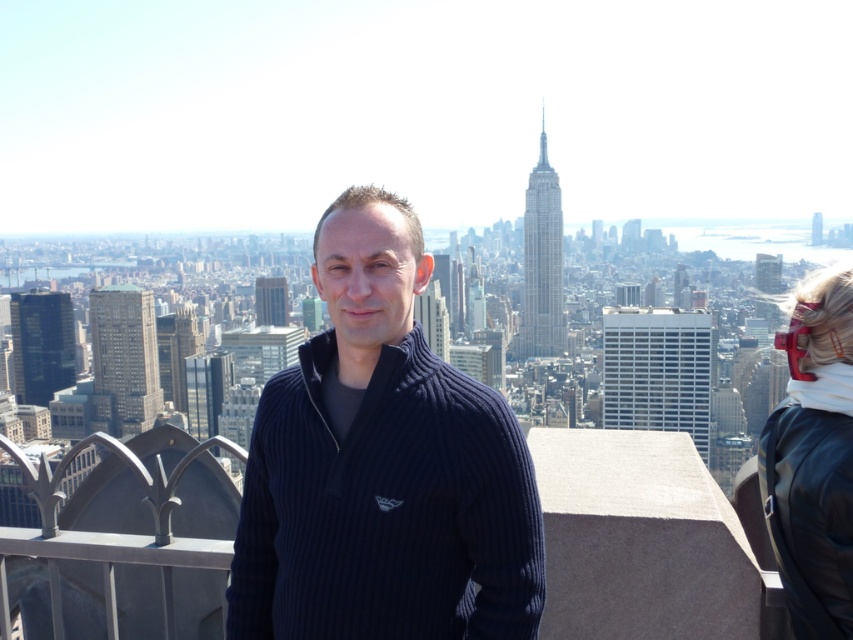
You are a photographer trying to capture the Empire State Building in the background. You notice two points of interest in your camera frame at coordinates point (421, 534) and point (782, 536). Which point is closer to your camera lens?

Point (421, 534) is further to the camera than point (782, 536), so the point closer to the camera lens is point (782, 536).

You are a photographer trying to capture the Empire State Building in the background. You notice the dark blue ribbed sweater at center and the white fleece at right in your frame. Which piece of clothing should you move to the left to ensure the Empire State Building is fully visible?

You should move the white fleece at right to the left because the dark blue ribbed sweater at center is already positioned to the left of the white fleece at right, so moving the white fleece would allow more space for the Empire State Building in the background.

You are a fashion designer analyzing the image. The person in the image is wearing a dark blue ribbed sweater at center. The sweater has a small logo on the left side of the chest. If you were to place a pin exactly at point (381, 467), where would it land on the sweater?

The point (381, 467) corresponds to the location of the small logo on the left side of the chest of the dark blue ribbed sweater at center.